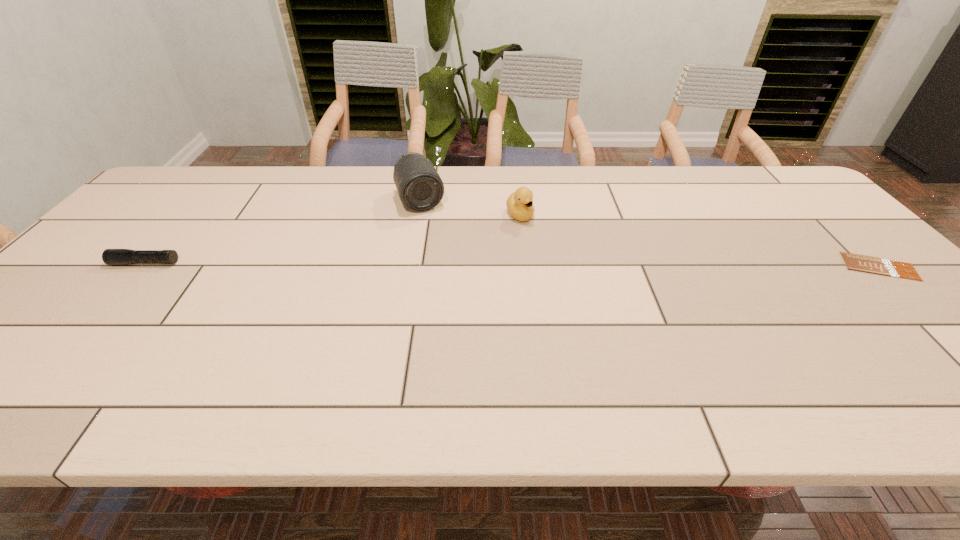
At what (x,y) coordinates should I click in order to perform the action: click on free space between the rightmost object and the second tallest object. Please return your answer as a coordinate pair (x, y). Looking at the image, I should click on (700, 241).

In order to click on blank region between the leftmost object and the shortest object in this screenshot , I will do `click(513, 265)`.

The width and height of the screenshot is (960, 540). I want to click on object that stands as the closest to the tallest object, so click(519, 204).

Locate an element on the screen. object that is the second closest one to the flashlight is located at coordinates (519, 204).

Identify the location of vacant area that satisfies the following two spatial constraints: 1. on the front side of the duckling; 2. on the left side of the third object from right to left. (418, 215).